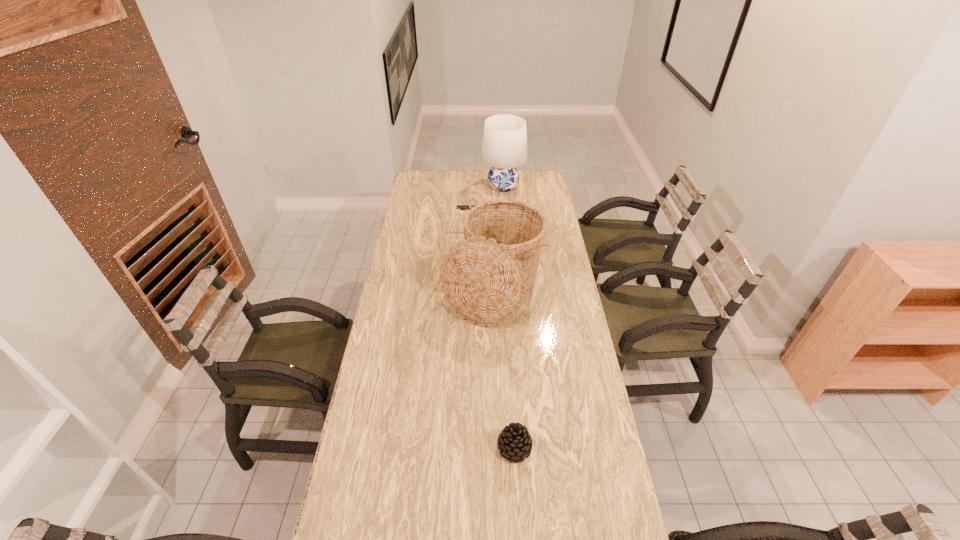
In the image, there is a desktop. At what (x,y) coordinates should I click in order to perform the action: click on vacant space at the right edge. Please return your answer as a coordinate pair (x, y). Looking at the image, I should click on (611, 524).

Locate an element on the screen. vacant region at the far left corner of the desktop is located at coordinates (419, 185).

Locate an element on the screen. vacant area that lies between the nearest object and the second farthest object is located at coordinates (495, 337).

Where is `free space between the third farthest object and the nearest object`? free space between the third farthest object and the nearest object is located at coordinates (503, 367).

Find the location of a particular element. Image resolution: width=960 pixels, height=540 pixels. empty space between the gun and the pinecone is located at coordinates (495, 337).

Locate an element on the screen. unoccupied area between the nearest object and the basket is located at coordinates (503, 367).

Choose which object is the third nearest neighbor to the nearest object. Please provide its 2D coordinates. Your answer should be formatted as a tuple, i.e. [(x, y)], where the tuple contains the x and y coordinates of a point satisfying the conditions above.

[(504, 147)]

Choose which object is the third nearest neighbor to the gun. Please provide its 2D coordinates. Your answer should be formatted as a tuple, i.e. [(x, y)], where the tuple contains the x and y coordinates of a point satisfying the conditions above.

[(514, 442)]